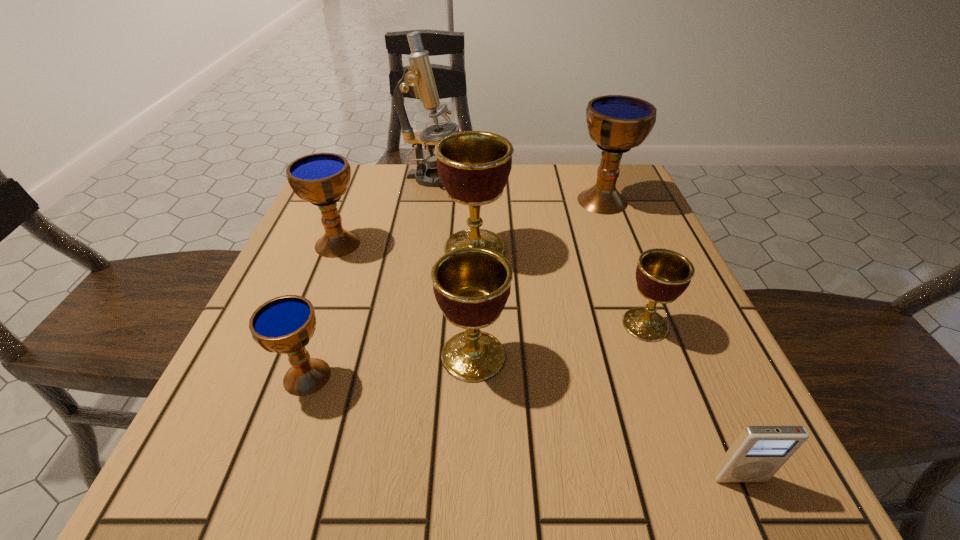
Where is `empty space that is in between the tallest object and the nearest object`? Image resolution: width=960 pixels, height=540 pixels. empty space that is in between the tallest object and the nearest object is located at coordinates pyautogui.click(x=586, y=328).

Image resolution: width=960 pixels, height=540 pixels. I want to click on empty location between the tallest object and the farthest golden chalice, so click(x=454, y=213).

I want to click on vacant region between the nearest blue chalice and the iPod, so click(x=523, y=427).

This screenshot has height=540, width=960. I want to click on vacant space in between the second smallest golden chalice and the second farthest blue chalice, so click(x=405, y=300).

The image size is (960, 540). In order to click on free space between the second biggest blue chalice and the iPod in this screenshot , I will do `click(539, 361)`.

Identify the location of vacant space that's between the biggest blue chalice and the tallest object. (517, 190).

Locate an element on the screen. Image resolution: width=960 pixels, height=540 pixels. free area in between the microscope and the biggest blue chalice is located at coordinates (517, 190).

Where is `object that can be found as the closest to the tallest object`? This screenshot has width=960, height=540. object that can be found as the closest to the tallest object is located at coordinates (474, 166).

Choose which object is the seventh nearest neighbor to the smallest golden chalice. Please provide its 2D coordinates. Your answer should be formatted as a tuple, i.e. [(x, y)], where the tuple contains the x and y coordinates of a point satisfying the conditions above.

[(321, 178)]

Select which chalice is the fourth closest to the second smallest blue chalice. Please provide its 2D coordinates. Your answer should be formatted as a tuple, i.e. [(x, y)], where the tuple contains the x and y coordinates of a point satisfying the conditions above.

[(616, 123)]